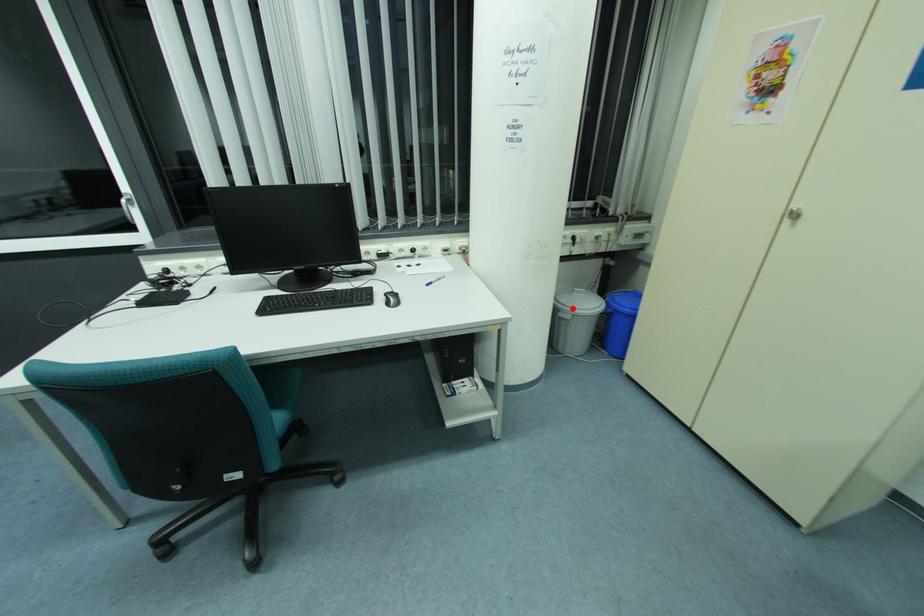
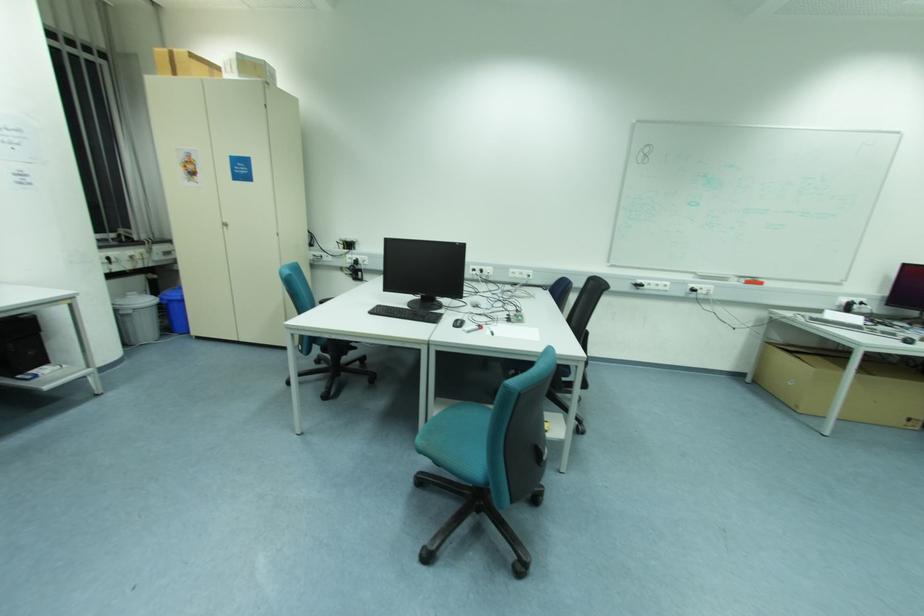
Question: I am providing you with two images of the same scene from different viewpoints. A red point is shown in image1. For the corresponding object point in image2, is it positioned nearer or farther from the camera?

Choices:
 (A) Nearer
 (B) Farther

Answer: (B)